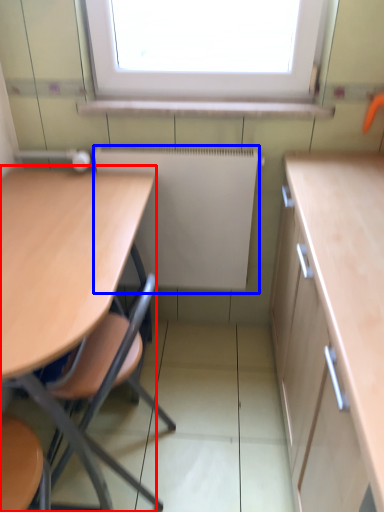
Question: Which point is closer to the camera, table (highlighted by a red box) or radiator (highlighted by a blue box)?

Choices:
 (A) table
 (B) radiator

Answer: (A)